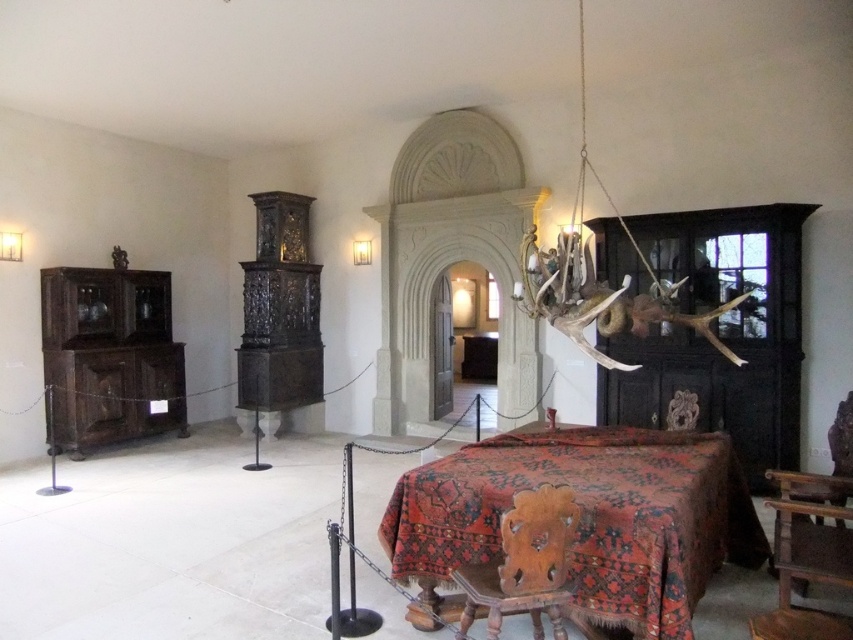
You are standing in the room and want to move from the wooden carved chair at center to the carpeted wooden table at center. Which direction should you move towards?

You should move to your right because the carpeted wooden table at center is located to the right of the wooden carved chair at center.

You are an interior designer planning to move a large potted plant into this room. You want to place it in a position where it can be seen from both the wooden carved chair at center and the dark brown wooden chair at right. Based on their positions, is this possible?

The wooden carved chair at center is located below the dark brown wooden chair at right, meaning they are positioned at different heights. Since both chairs are in the same room, the potted plant can be placed in a central area where it is visible from both chairs due to their vertical arrangement.

You are an interior designer planning to move the dark brown wood cabinet at left and the wooden carved chair at center closer together. Based on their widths, which object should be placed on the side with more space to ensure they fit properly?

The dark brown wood cabinet at left is wider than the wooden carved chair at center. Therefore, the wider cabinet should be placed on the side with more space to accommodate its dimensions.